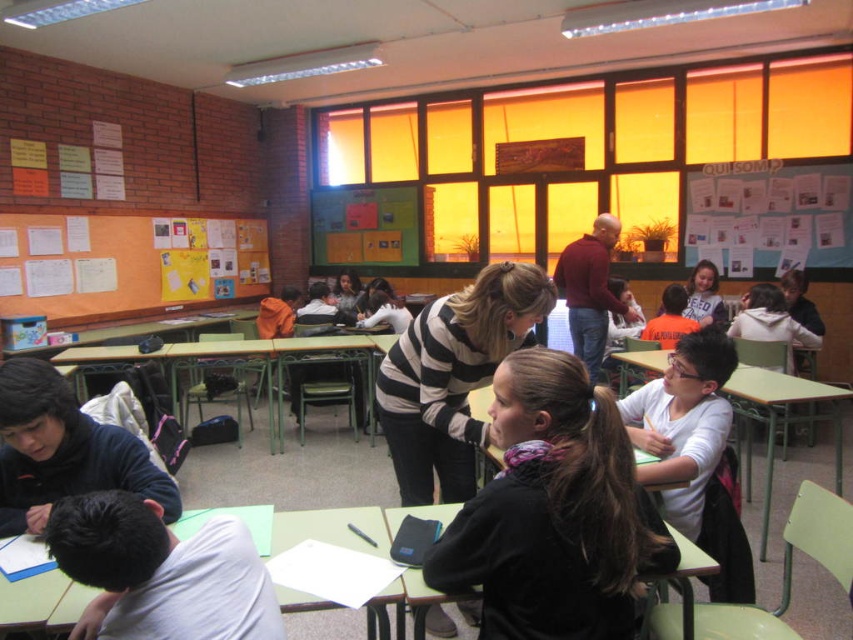
Question: Is orange corkboard at upper left above green plastic table at center?

Choices:
 (A) no
 (B) yes

Answer: (B)

Question: Which object is farther from the camera taking this photo?

Choices:
 (A) maroon sweater at center
 (B) green matte table at lower center
 (C) green plastic table at lower right

Answer: (A)

Question: Which of the following is the closest to the observer?

Choices:
 (A) maroon sweater at center
 (B) green plastic table at center
 (C) green matte table at lower center
 (D) black matte jacket at center

Answer: (D)

Question: Is green plastic table at lower right positioned at the back of green matte table at lower center?

Choices:
 (A) yes
 (B) no

Answer: (A)

Question: Where is green plastic table at center located in relation to green matte table at lower center in the image?

Choices:
 (A) above
 (B) below

Answer: (A)

Question: Which object is positioned farthest from the black matte jacket at center?

Choices:
 (A) orange corkboard at upper left
 (B) matte orange shirt at center
 (C) maroon sweater at center

Answer: (A)